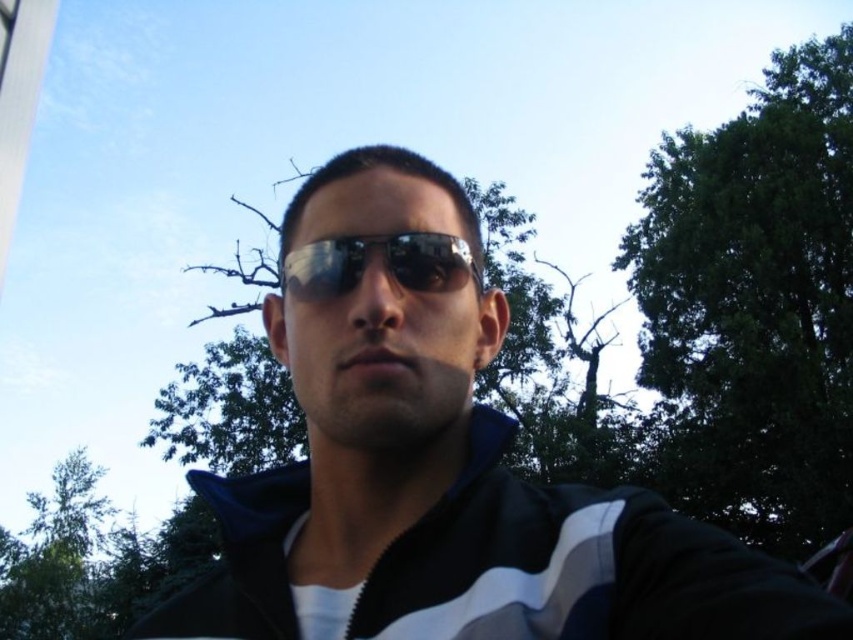
Question: Which point is farther from the camera taking this photo?

Choices:
 (A) (759, 340)
 (B) (677, 554)
 (C) (471, 273)

Answer: (A)

Question: Does green leafy tree at upper right have a larger size compared to black/white jacket at center?

Choices:
 (A) no
 (B) yes

Answer: (B)

Question: Can you confirm if black matte sunglasses at center is positioned below green leafy tree at upper right?

Choices:
 (A) no
 (B) yes

Answer: (B)

Question: Based on their relative distances, which object is nearer to the green leafy tree at upper right?

Choices:
 (A) black matte sunglasses at center
 (B) black/white jacket at center
 (C) shiny reflective sunglasses at center

Answer: (C)

Question: Does black matte sunglasses at center have a smaller size compared to black/white jacket at center?

Choices:
 (A) yes
 (B) no

Answer: (B)

Question: Which object appears farthest from the camera in this image?

Choices:
 (A) green leafy tree at upper right
 (B) black/white jacket at center
 (C) shiny reflective sunglasses at center

Answer: (A)